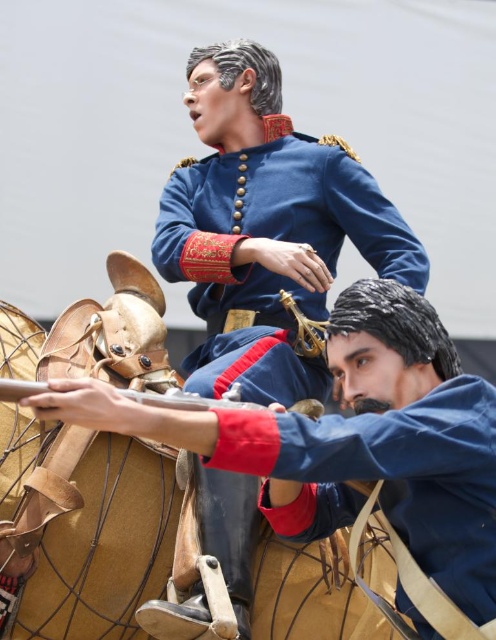
You are a photographer standing at the edge of the scene. You want to take a photo of both the matte blue uniform at center and the blue satin uniform at center. Given that your camera has a maximum focus range of 10 meters, will you be able to capture both subjects clearly in the same frame?

The matte blue uniform at center is 10.61 meters away from the blue satin uniform at center. Since the distance between them exceeds the camera maximum focus range of 10 meters, the camera cannot focus on both subjects simultaneously, so you won wait be able to capture both clearly in the same frame.

You are a military historian examining this historical image. You notice the matte blue uniform at center and the metallic gun at center. Which object takes up more space in the image?

The matte blue uniform at center is bigger than the metallic gun at center, so it takes up more space in the image.